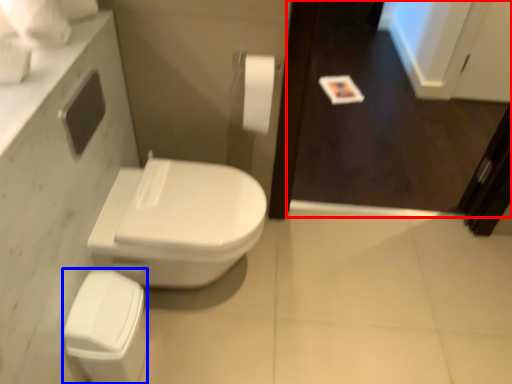
Question: Which object appears farthest to the camera in this image, screen door (highlighted by a red box) or porcelain (highlighted by a blue box)?

Choices:
 (A) screen door
 (B) porcelain

Answer: (A)